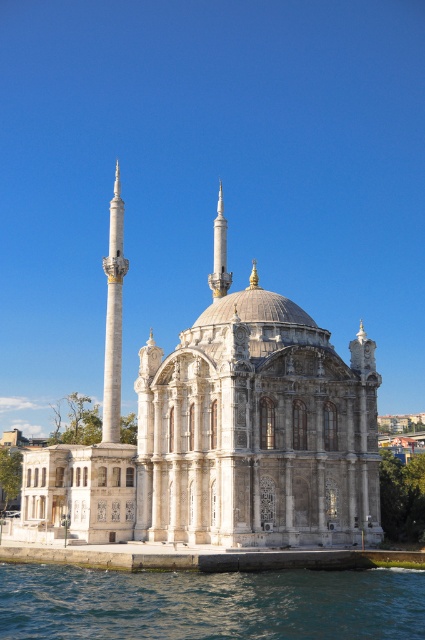
Question: Can you confirm if white stone mosque at center is thinner than blue water at lower center?

Choices:
 (A) yes
 (B) no

Answer: (B)

Question: Is blue water at lower center wider than white marble minaret at left?

Choices:
 (A) yes
 (B) no

Answer: (A)

Question: Which point is closer to the camera?

Choices:
 (A) white stone mosque at center
 (B) white marble minaret at left

Answer: (A)

Question: Which of the following is the farthest from the observer?

Choices:
 (A) white stone mosque at center
 (B) blue water at lower center

Answer: (A)

Question: Can you confirm if white stone mosque at center is positioned to the left of white marble minaret at left?

Choices:
 (A) yes
 (B) no

Answer: (B)

Question: Which of the following is the closest to the observer?

Choices:
 (A) blue water at lower center
 (B) white stone mosque at center
 (C) white marble minaret at left

Answer: (A)